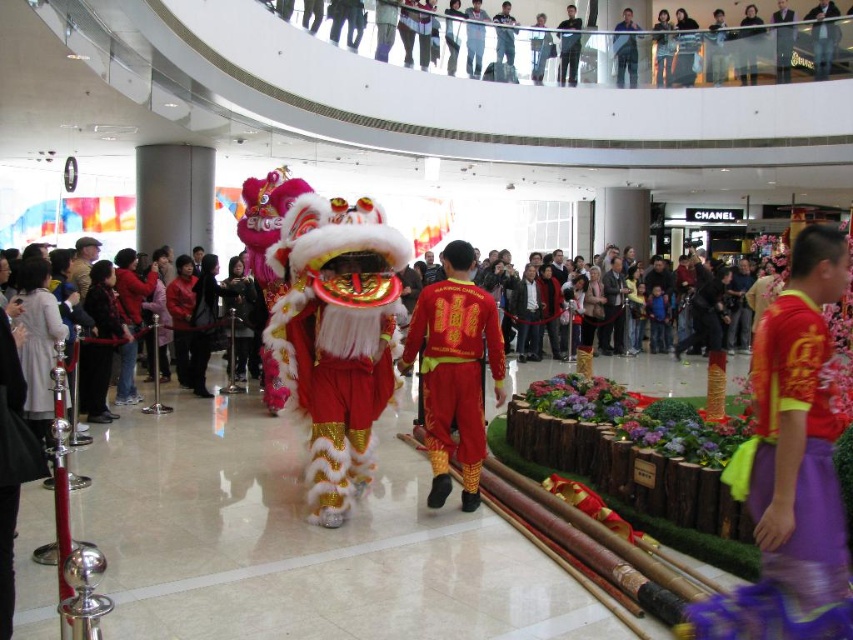
You are a photographer standing in the shopping mall atrium. You want to take a photo of the dark gray pants at upper center and the matte black jacket at upper center to capture their position relative to each other. Based on the scene description, which object is positioned lower in the image?

The dark gray pants at upper center is positioned lower than the matte black jacket at upper center in the image.

You are a photographer at the shopping mall and want to capture both the red satin costume at center and the blue fabric shirt at upper center in a single photo. Which of the two items should you focus on first to ensure they both appear clearly in the photo?

The red satin costume at center has a smaller size compared to blue fabric shirt at upper center, so you should focus on the red satin costume at center first to ensure both appear clearly in the photo.

You are a photographer standing in the shopping mall atrium. You want to take a photo of the red satin costume at center and the dark gray pants at upper center. Which object should you focus on first if you want to capture both in a single frame without moving your camera?

The dark gray pants at upper center should be focused on first because the red satin costume at center is located below it, allowing both to be captured in the frame by adjusting the camera angle slightly upwards.